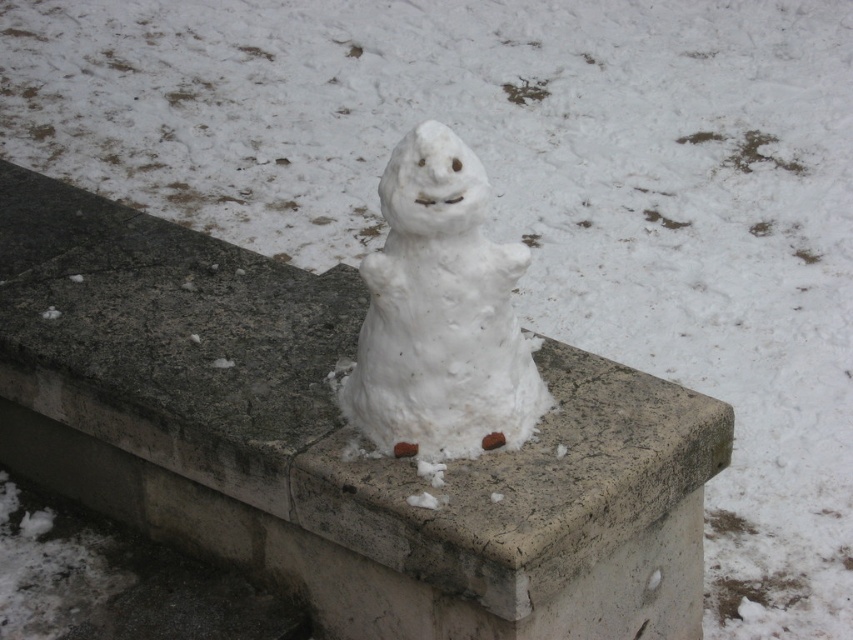
Question: Is concrete at center thinner than white matte snowman at center?

Choices:
 (A) yes
 (B) no

Answer: (B)

Question: Does concrete at center appear on the left side of white matte snowman at center?

Choices:
 (A) no
 (B) yes

Answer: (B)

Question: Does concrete at center appear under white matte snowman at center?

Choices:
 (A) yes
 (B) no

Answer: (A)

Question: Which object is closer to the camera taking this photo?

Choices:
 (A) concrete at center
 (B) white matte snowman at center

Answer: (A)

Question: Which object appears closest to the camera in this image?

Choices:
 (A) white matte snowman at center
 (B) concrete at center

Answer: (B)